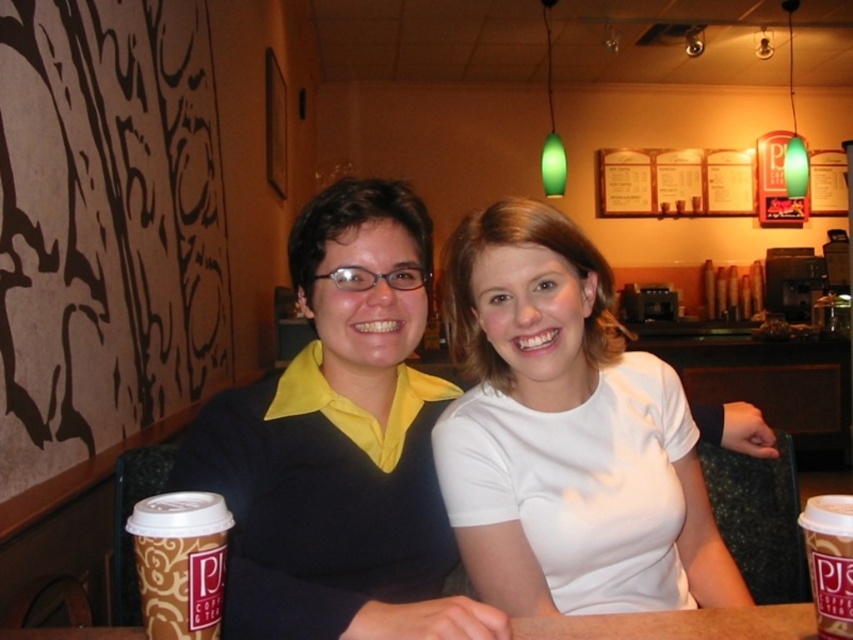
You are standing at the entrance of the coffee shop and see two points marked on the floor. The first point is labeled as point (724, 593) and the second as point (698, 611). If you want to move towards the counter area, which point should you walk towards first?

Point (724, 593) is behind point (698, 611), so you should walk towards point (698, 611) first as it is closer to the entrance and in the direction of the counter area.

You are a barista at P.J. Coffee and need to pour a hot drink into the larger cup. Which cup should you choose between the brown paper cup at lower left and the brown paper cup at lower right?

The brown paper cup at lower left is larger in size compared to the brown paper cup at lower right, so you should pour the hot drink into the brown paper cup at lower left.